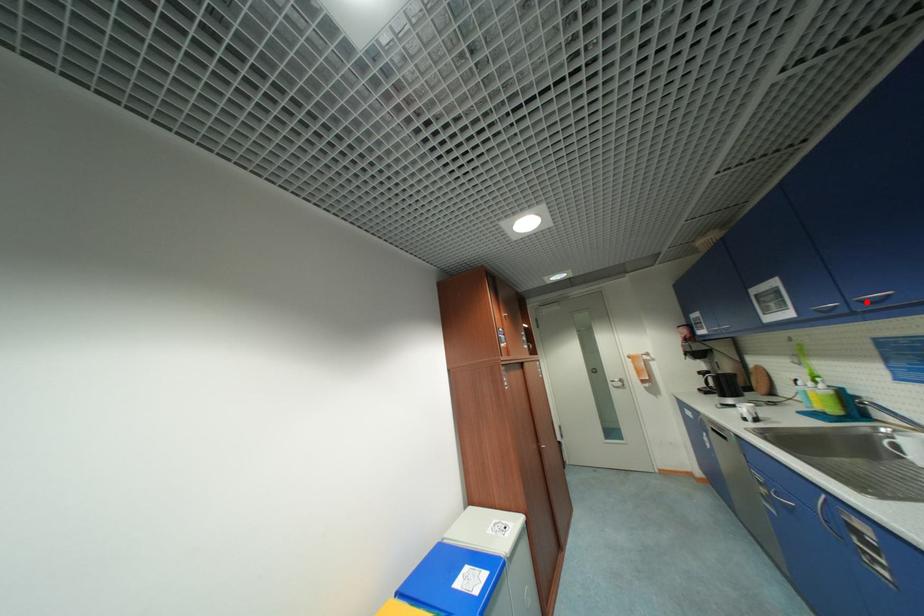
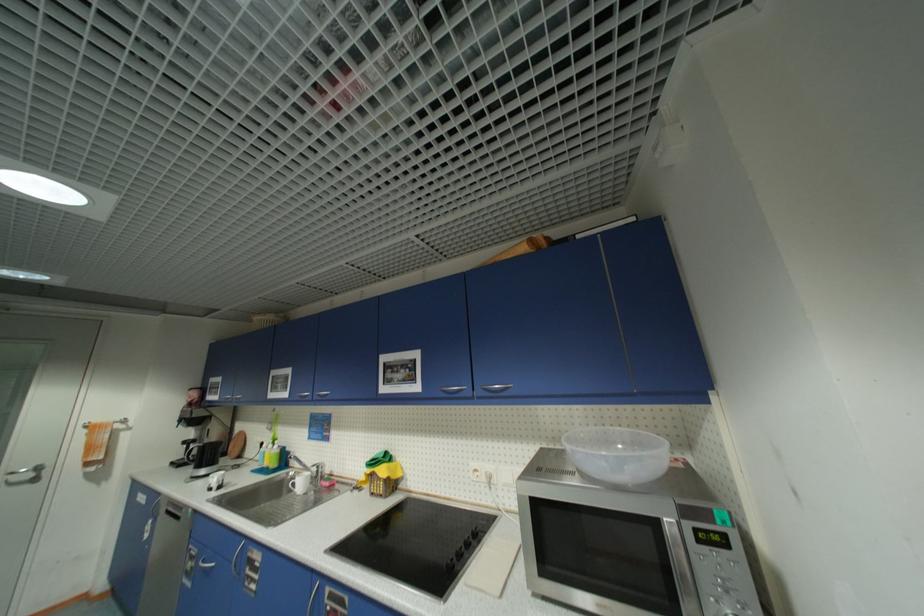
Where in the second image is the point corresponding to the highlighted location from the first image?

(323, 395)